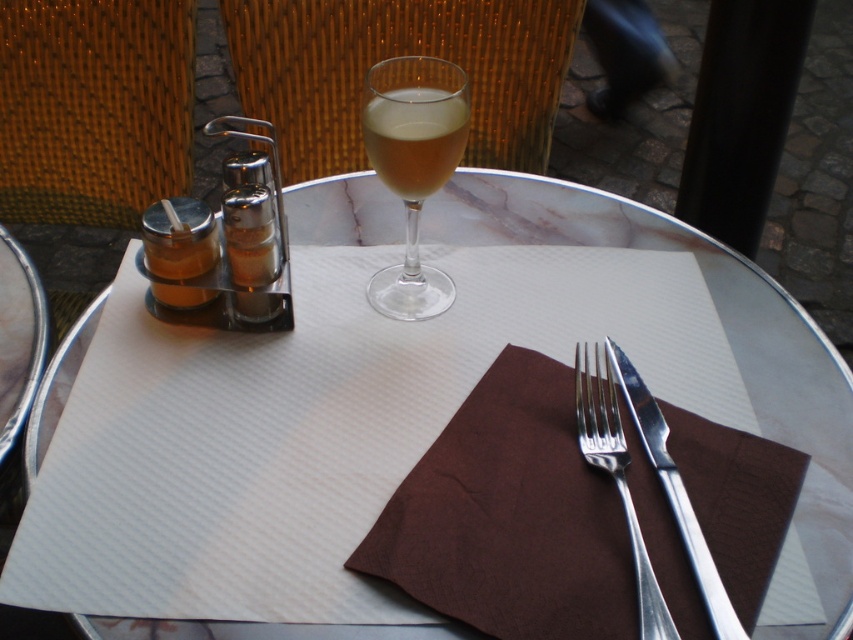
You are a customer at the outdoor table. The server asks you to locate the brown paper napkin at center. What are its coordinates?

The brown paper napkin at center is located at coordinates point [509,516].